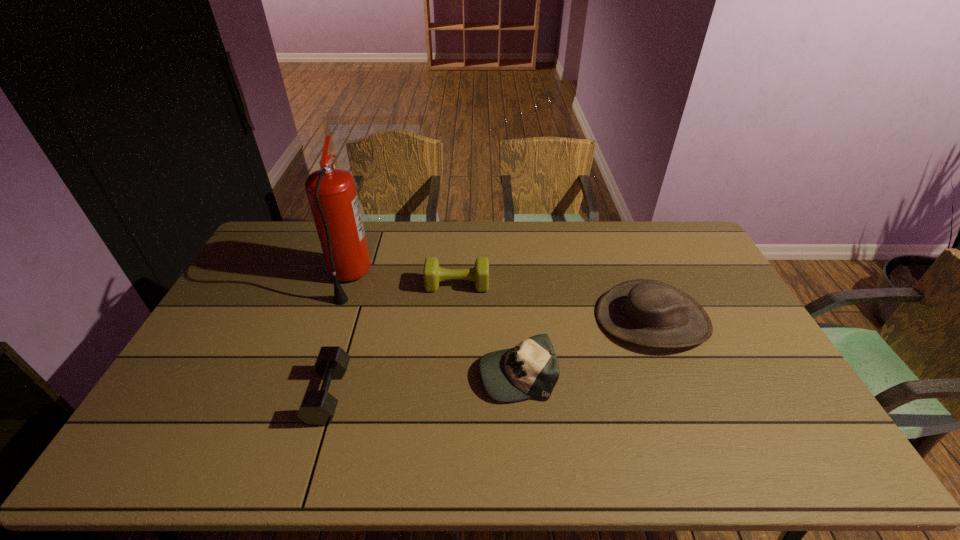
Image resolution: width=960 pixels, height=540 pixels. I want to click on the tallest object, so coord(331,192).

Identify the location of cowboy hat. This screenshot has width=960, height=540. (650, 313).

Locate an element on the screen. the farther dumbbell is located at coordinates (433, 274).

At what (x,y) coordinates should I click in order to perform the action: click on baseball cap. Please return your answer as a coordinate pair (x, y). The height and width of the screenshot is (540, 960). Looking at the image, I should click on (530, 369).

This screenshot has height=540, width=960. In order to click on the left dumbbell in this screenshot , I will do `click(317, 408)`.

Locate an element on the screen. free space located on the instruction side of the tallest object is located at coordinates (413, 278).

Where is `free space located on the front of the cowboy hat`? free space located on the front of the cowboy hat is located at coordinates (675, 373).

At what (x,y) coordinates should I click in order to perform the action: click on vacant space situated 0.350m on the right of the right dumbbell. Please return your answer as a coordinate pair (x, y). Looking at the image, I should click on (591, 285).

Identify the location of vacant space located 0.400m on the front-facing side of the baseball cap. This screenshot has height=540, width=960. (336, 373).

What are the coordinates of `vacant area situated on the front-facing side of the baseball cap` in the screenshot? It's located at (340, 373).